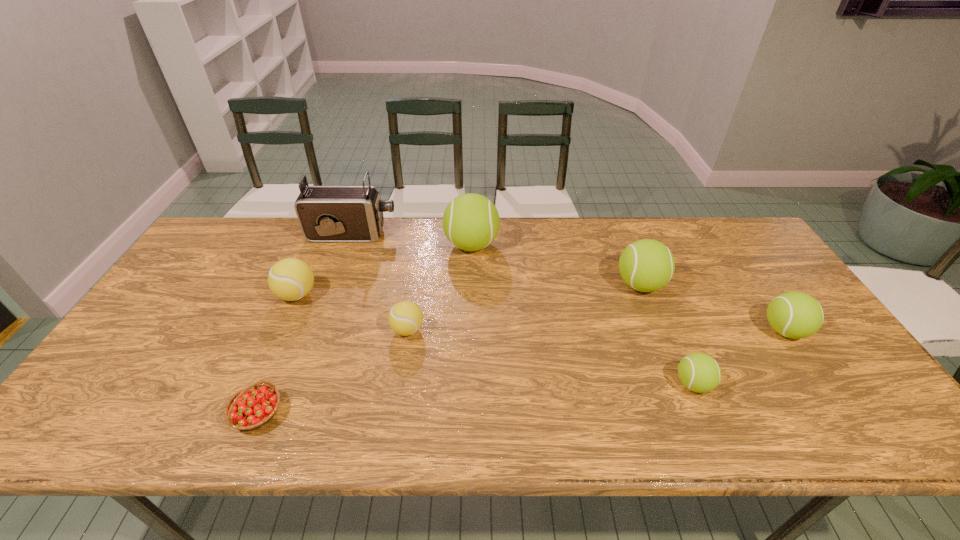
The height and width of the screenshot is (540, 960). Identify the location of blank area at the near right corner. (884, 408).

Where is `blank region between the brown strawberry and the smaller yellow tennis ball`? Image resolution: width=960 pixels, height=540 pixels. blank region between the brown strawberry and the smaller yellow tennis ball is located at coordinates (332, 372).

Where is `empty space between the nearest green tennis ball and the smaller yellow tennis ball`? Image resolution: width=960 pixels, height=540 pixels. empty space between the nearest green tennis ball and the smaller yellow tennis ball is located at coordinates (550, 357).

At what (x,y) coordinates should I click in order to perform the action: click on free point between the smallest green tennis ball and the third smallest green tennis ball. Please return your answer as a coordinate pair (x, y). The width and height of the screenshot is (960, 540). Looking at the image, I should click on (666, 334).

Locate an element on the screen. This screenshot has height=540, width=960. vacant area that lies between the rightmost object and the nearest green tennis ball is located at coordinates (738, 357).

Locate an element on the screen. This screenshot has width=960, height=540. free space between the rightmost green tennis ball and the fifth tennis ball from right to left is located at coordinates (596, 330).

In order to click on free space between the nearest tennis ball and the tallest object in this screenshot , I will do `click(522, 309)`.

The height and width of the screenshot is (540, 960). What are the coordinates of `free space between the tallest object and the leftmost tennis ball` in the screenshot? It's located at click(324, 265).

What are the coordinates of `free space between the tallest object and the smallest green tennis ball` in the screenshot? It's located at (522, 309).

This screenshot has height=540, width=960. Find the location of `empty space between the nearer yellow tennis ball and the farther yellow tennis ball`. empty space between the nearer yellow tennis ball and the farther yellow tennis ball is located at coordinates (352, 312).